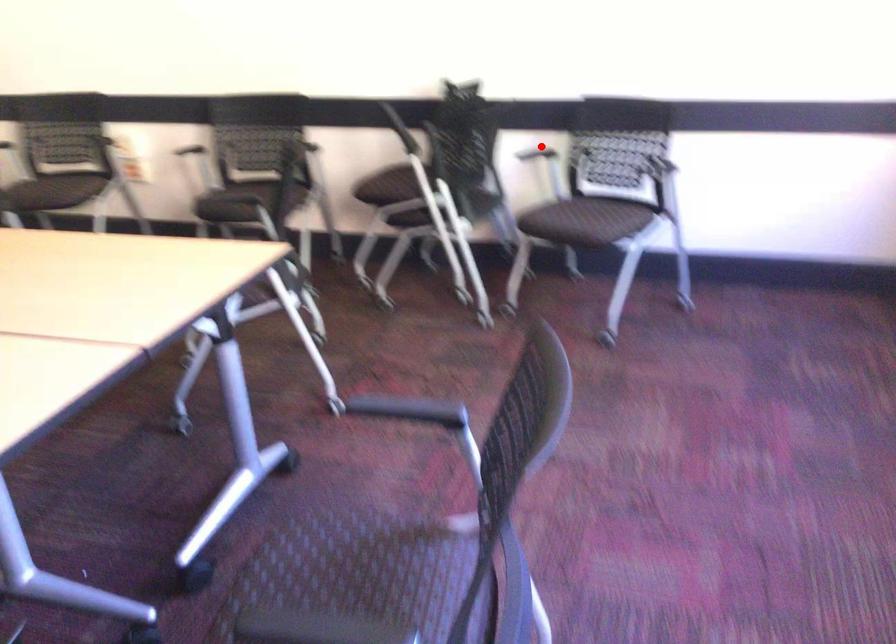
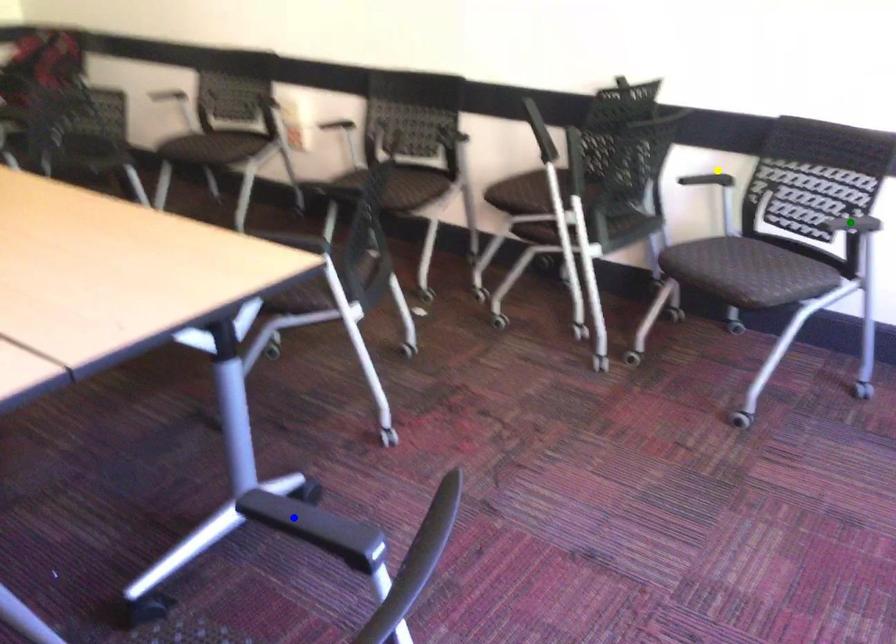
Question: I am providing you with two images of the same scene from different viewpoints. A red point is marked on the first image. You are given multiple points on the second image. Which point in image 2 is actually the same real-world point as the red point in image 1?

Choices:
 (A) yellow point
 (B) blue point
 (C) green point

Answer: (A)